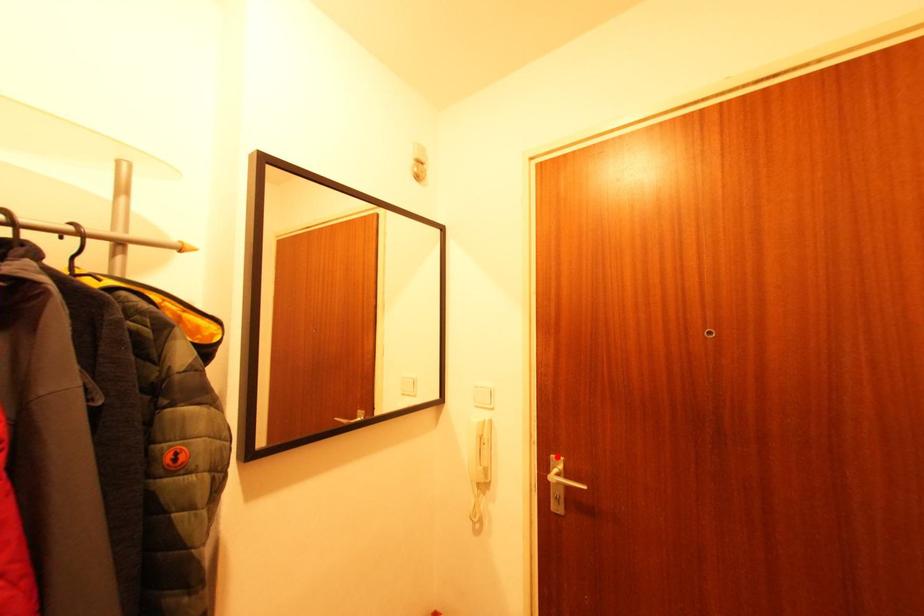
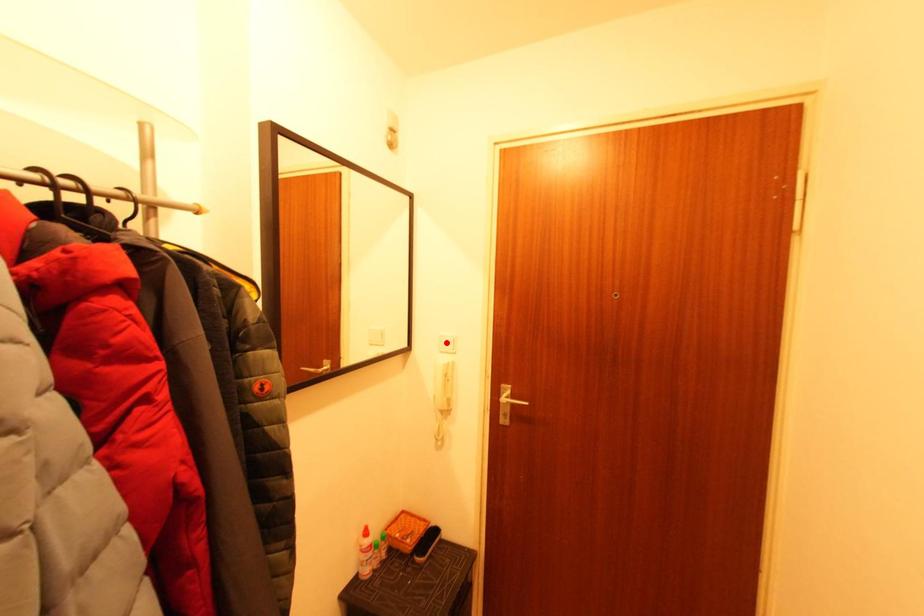
I am providing you with two images of the same scene from different viewpoints. A red point is marked on the first image and another point is marked on the second image. Does the point marked in image1 correspond to the same location as the one in image2?

No